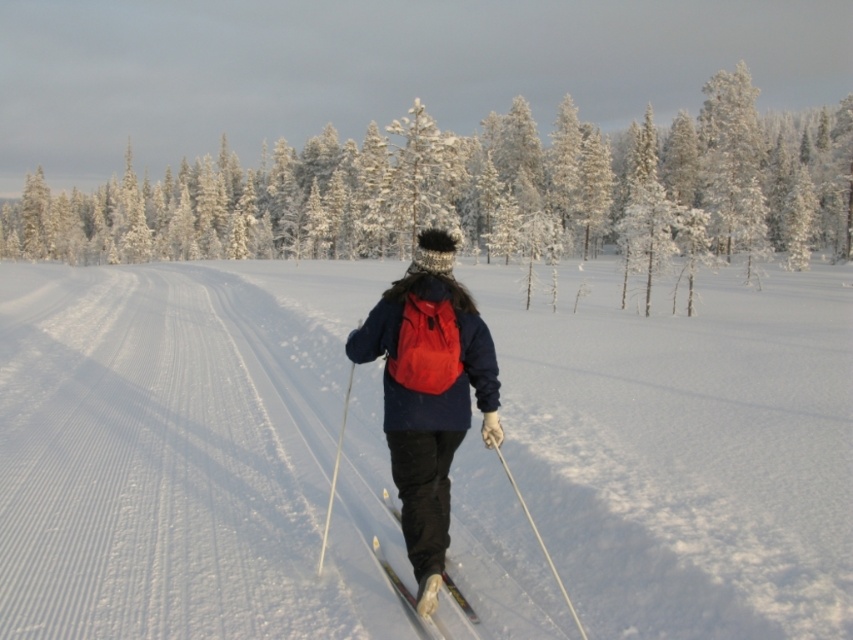
Question: Does matte blue jacket at center have a larger size compared to white plastic ski pole at lower center?

Choices:
 (A) no
 (B) yes

Answer: (B)

Question: Considering the real-world distances, which object is closest to the white plastic ski pole at lower center?

Choices:
 (A) shiny metallic ski at center
 (B) matte blue jacket at center
 (C) white snow-covered tree at center

Answer: (B)

Question: Does white snow-covered tree at center have a larger size compared to white plastic ski pole at lower center?

Choices:
 (A) yes
 (B) no

Answer: (A)

Question: Which of the following is the closest to the observer?

Choices:
 (A) (444, 634)
 (B) (223, 294)
 (C) (556, 584)

Answer: (A)

Question: Considering the relative positions of matte blue jacket at center and white plastic ski pole at lower center in the image provided, where is matte blue jacket at center located with respect to white plastic ski pole at lower center?

Choices:
 (A) below
 (B) above

Answer: (B)

Question: Among these points, which one is nearest to the camera?

Choices:
 (A) (469, 616)
 (B) (497, 445)

Answer: (A)